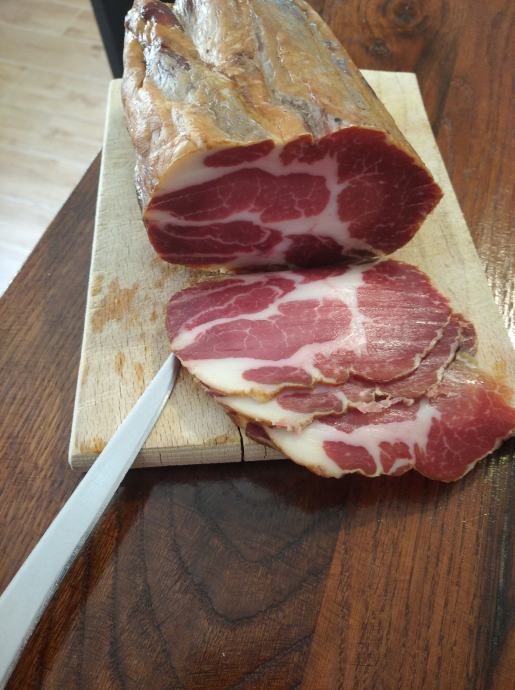
The image size is (515, 690). Identify the location of cutting board. (104, 353).